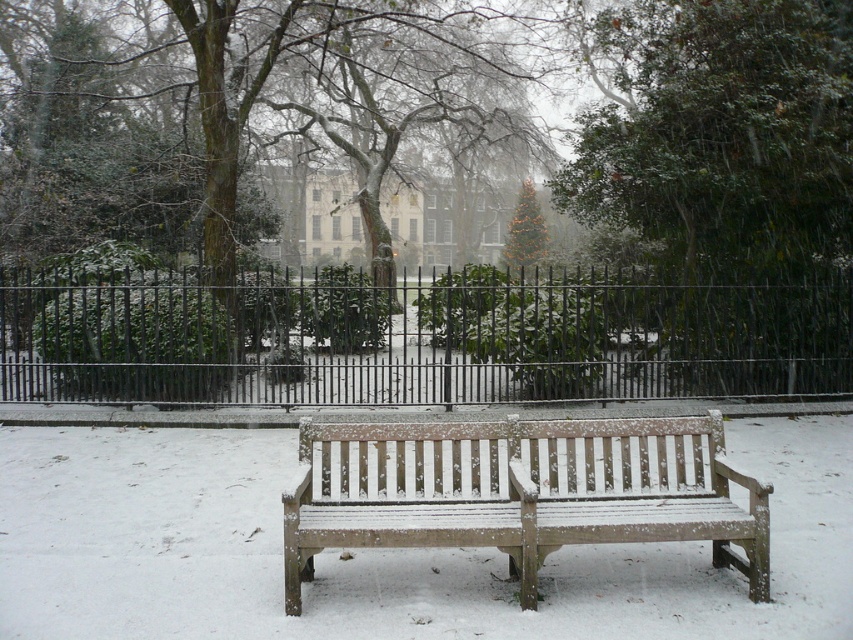
You are standing in a winter park and see the black metal fence at center and the green leafy tree at center. Which object is wider?

The black metal fence at center is wider than the green leafy tree at center.

You are standing at the wooden bench covered with snow and want to reach the point marked as point (413, 339). Which object in the scene is located at that coordinate?

The point (413, 339) corresponds to the black metal fence at center.